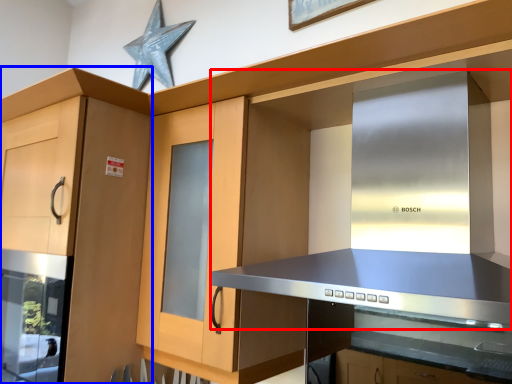
Question: Which object is further to the camera taking this photo, vent (highlighted by a red box) or cabinetry (highlighted by a blue box)?

Choices:
 (A) vent
 (B) cabinetry

Answer: (B)